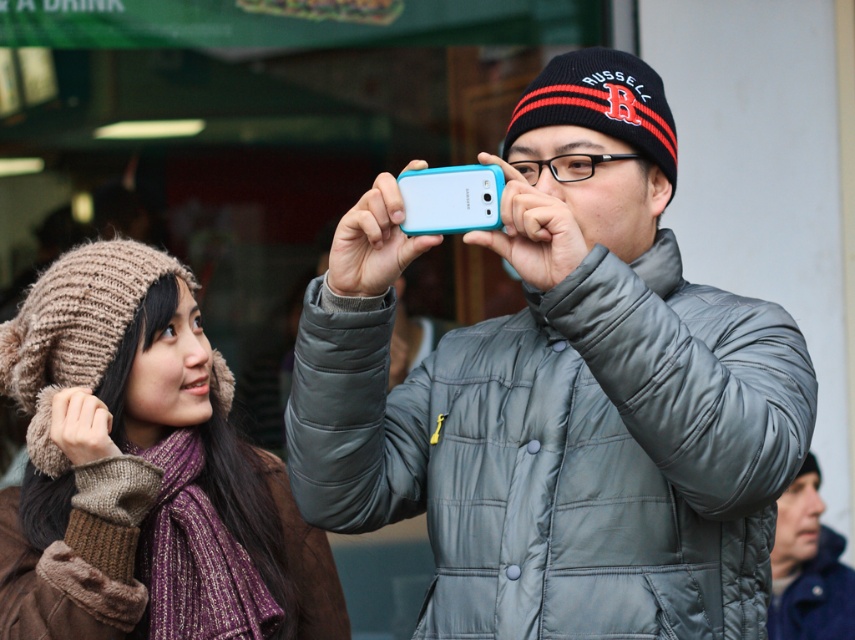
Can you confirm if teal matte phone at center is bigger than dark blue leather jacket at lower right?

Correct, teal matte phone at center is larger in size than dark blue leather jacket at lower right.

Is point (364, 324) farther from camera compared to point (789, 548)?

No, it is not.

Between point (699, 429) and point (830, 582), which one is positioned in front?

Positioned in front is point (699, 429).

What are the coordinates of `teal matte phone at center` in the screenshot? It's located at (561, 394).

Between point (562, 224) and point (299, 536), which one is positioned in front?

Point (562, 224) is in front.

Can you confirm if teal matte phone at center is positioned above knitted woolen hat at upper left?

Indeed, teal matte phone at center is positioned over knitted woolen hat at upper left.

Between point (457, 440) and point (118, 400), which one is positioned in front?

Positioned in front is point (457, 440).

You are a GUI agent. You are given a task and a screenshot of the screen. Output one action in this format:
    pyautogui.click(x=<x>, y=<y>)
    Task: Click on the teal matte phone at center
    This screenshot has width=855, height=640.
    Given the screenshot: What is the action you would take?
    pyautogui.click(x=561, y=394)

Between dark blue leather jacket at lower right and teal matte smartphone at center, which one appears on the right side from the viewer's perspective?

dark blue leather jacket at lower right is more to the right.

Between dark blue leather jacket at lower right and teal matte smartphone at center, which one is positioned lower?

dark blue leather jacket at lower right is lower down.

Which is behind, point (777, 589) or point (443, 209)?

The point (777, 589) is more distant.

Locate an element on the screen. The height and width of the screenshot is (640, 855). dark blue leather jacket at lower right is located at coordinates (808, 566).